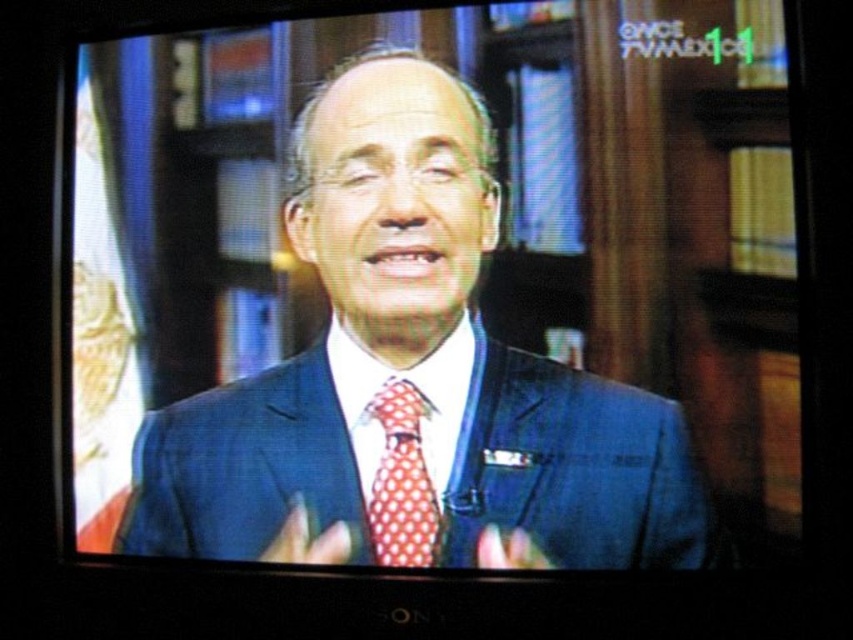
Question: Which object is positioned closest to the blue suit at center?

Choices:
 (A) polka dot silk tie at center
 (B) blue textured suit at center

Answer: (B)

Question: Which of the following is the closest to the observer?

Choices:
 (A) (395, 163)
 (B) (666, 515)
 (C) (381, 561)

Answer: (B)

Question: Which of the following is the farthest from the observer?

Choices:
 (A) (482, 211)
 (B) (427, 554)

Answer: (A)

Question: Can you confirm if blue textured suit at center is positioned below polka dot silk tie at center?

Choices:
 (A) yes
 (B) no

Answer: (B)

Question: Does blue suit at center have a smaller size compared to polka dot silk tie at center?

Choices:
 (A) yes
 (B) no

Answer: (B)

Question: Can you confirm if blue suit at center is positioned below polka dot silk tie at center?

Choices:
 (A) yes
 (B) no

Answer: (B)